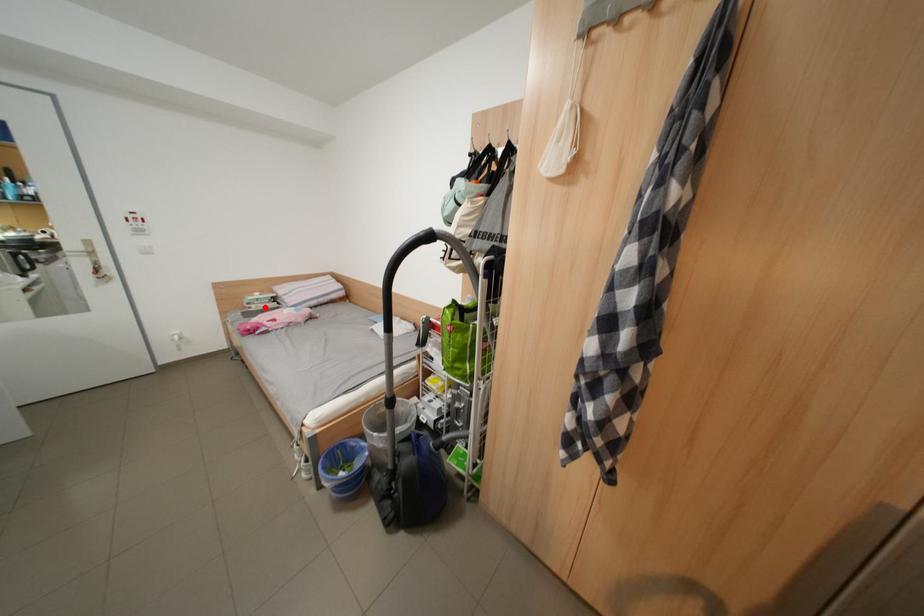
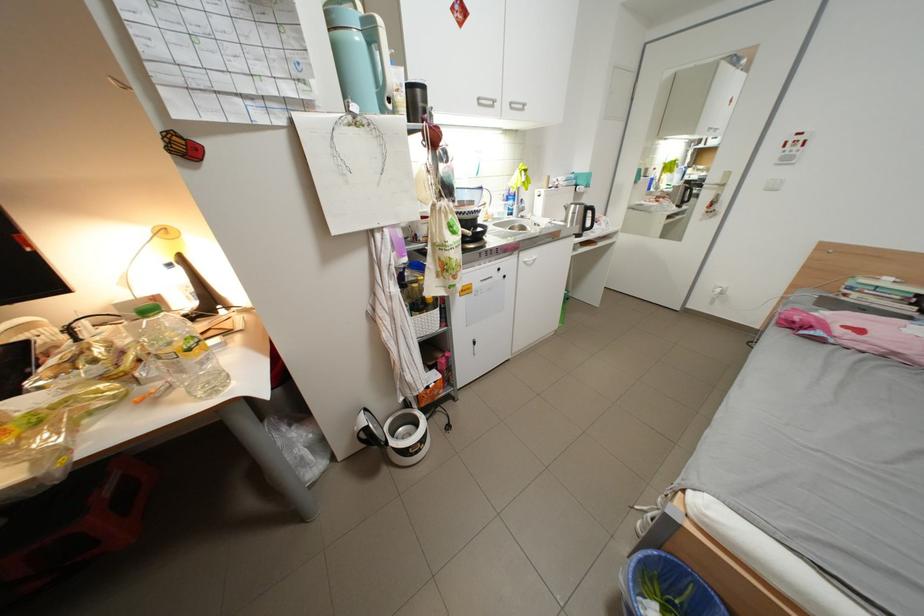
Locate, in the second image, the point that corresponds to the highlighted location in the first image.

(867, 296)